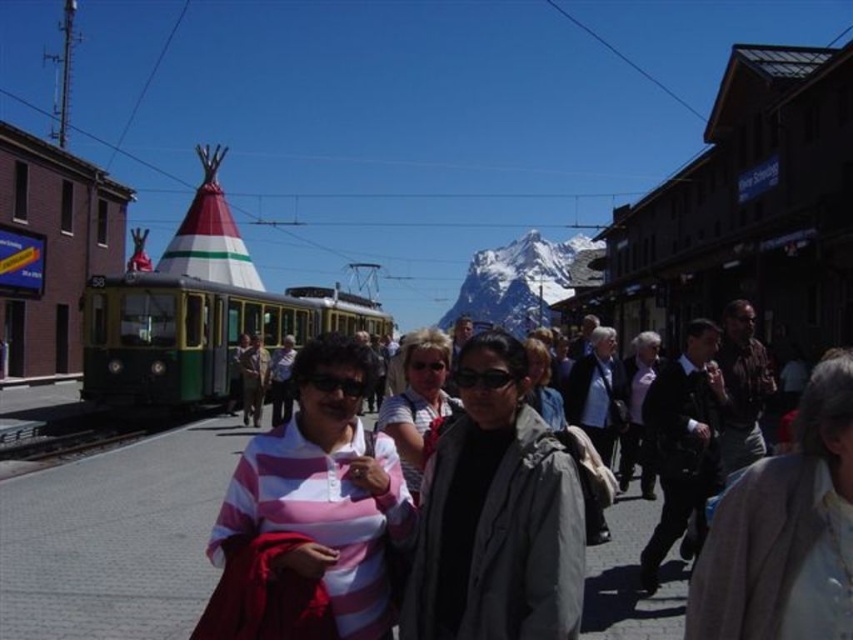
Looking at this image, can you confirm if gray matte jacket at center is smaller than matte black jacket at center?

Yes.

Can you confirm if gray matte jacket at center is taller than matte black jacket at center?

Correct, gray matte jacket at center is much taller as matte black jacket at center.

This screenshot has width=853, height=640. Describe the element at coordinates (496, 515) in the screenshot. I see `gray matte jacket at center` at that location.

This screenshot has width=853, height=640. What are the coordinates of `gray matte jacket at center` in the screenshot? It's located at (496, 515).

Does pink striped shirt at center come in front of white snow-covered mountain at center?

Yes, pink striped shirt at center is in front of white snow-covered mountain at center.

Can you confirm if pink striped shirt at center is positioned above white snow-covered mountain at center?

Incorrect, pink striped shirt at center is not positioned above white snow-covered mountain at center.

The height and width of the screenshot is (640, 853). Find the location of `pink striped shirt at center`. pink striped shirt at center is located at coordinates (310, 515).

Does white snow-covered mountain at center have a lesser height compared to matte gray jacket at center?

No.

Is white snow-covered mountain at center positioned before matte gray jacket at center?

No, it is not.

What do you see at coordinates (515, 282) in the screenshot? The width and height of the screenshot is (853, 640). I see `white snow-covered mountain at center` at bounding box center [515, 282].

This screenshot has height=640, width=853. I want to click on white snow-covered mountain at center, so click(x=515, y=282).